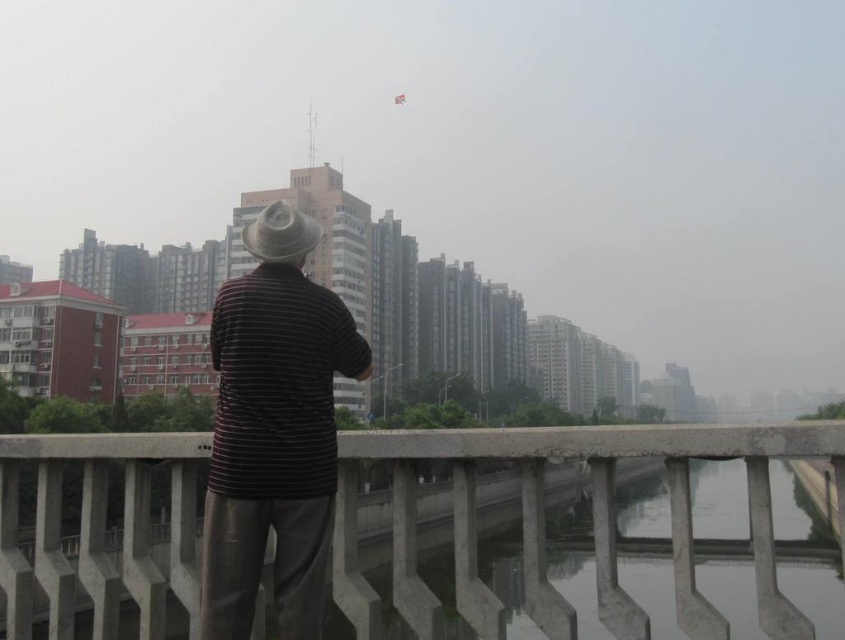
Is concrete bridge at center positioned behind striped cotton shirt at center?

No, it is not.

Where is `concrete bridge at center`? concrete bridge at center is located at coordinates (592, 522).

Identify the location of concrete bridge at center. This screenshot has width=845, height=640. (592, 522).